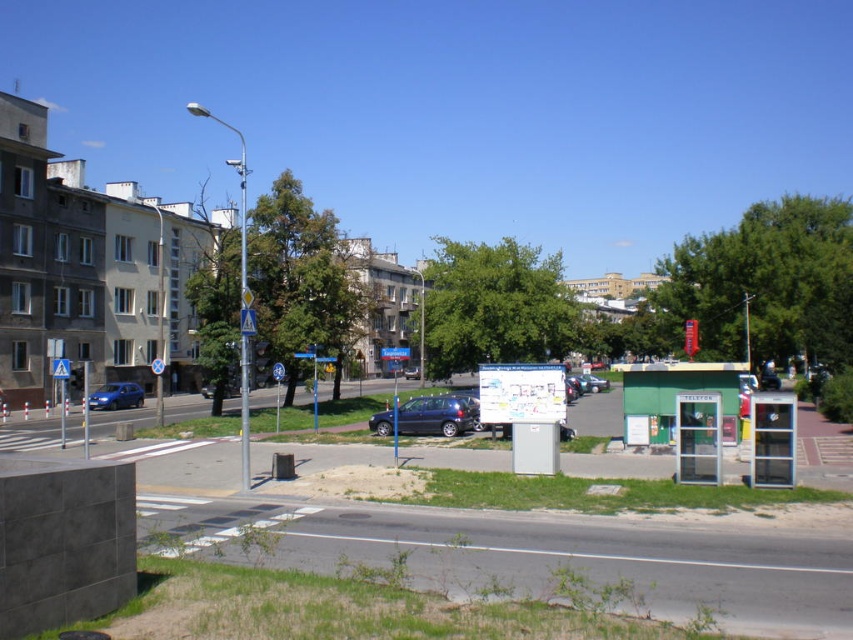
Question: Is metallic blue hatchback at center positioned at the back of metallic silver sedan at center?

Choices:
 (A) no
 (B) yes

Answer: (A)

Question: Can you confirm if metallic blue hatchback at center is positioned to the left of metallic blue sedan at lower left?

Choices:
 (A) yes
 (B) no

Answer: (B)

Question: Which point is farther from the camera taking this photo?

Choices:
 (A) (439, 412)
 (B) (579, 381)

Answer: (B)

Question: Which object is farther from the camera taking this photo?

Choices:
 (A) metallic blue hatchback at center
 (B) metallic silver sedan at center

Answer: (B)

Question: Is metallic blue sedan at lower left wider than metallic silver sedan at center?

Choices:
 (A) yes
 (B) no

Answer: (B)

Question: Which point is closer to the camera?

Choices:
 (A) (140, 401)
 (B) (585, 378)
 (C) (442, 426)

Answer: (C)